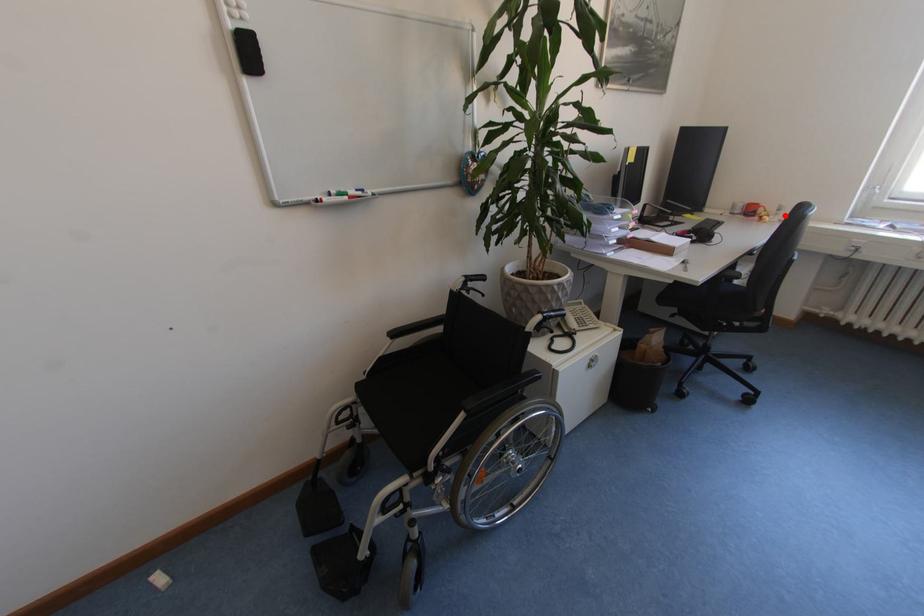
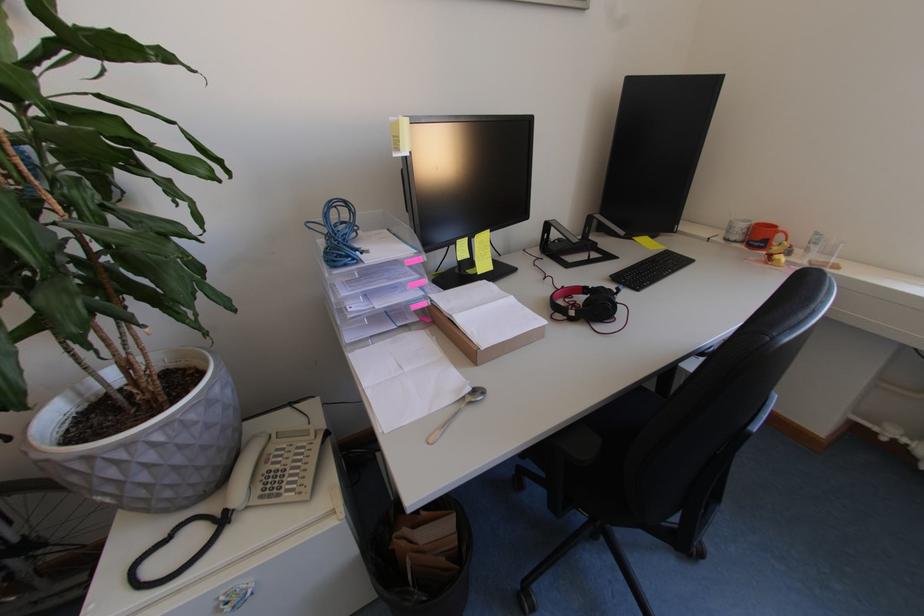
In the second image, find the point that corresponds to the highlighted location in the first image.

(816, 253)